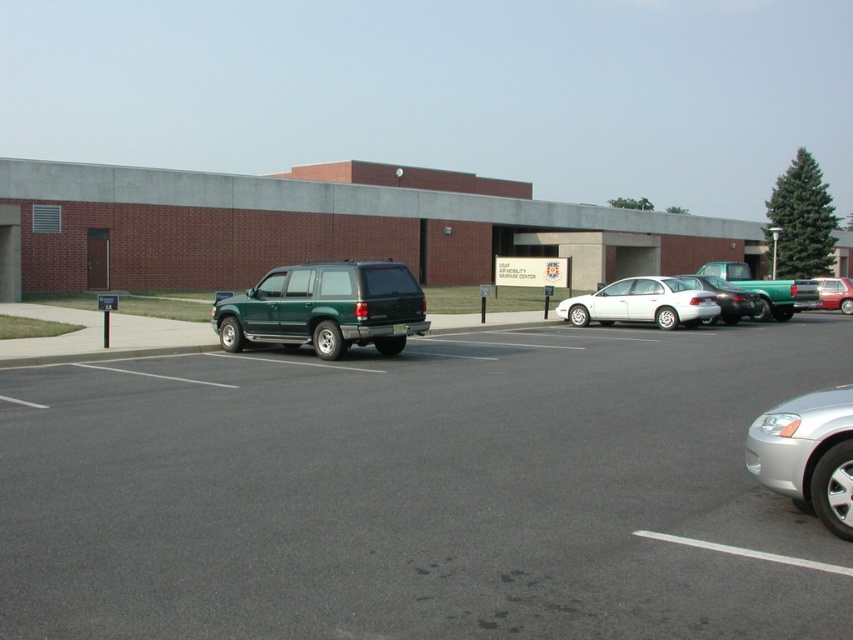
Can you confirm if silver metallic sedan at lower right is wider than white glossy sedan at center?

Incorrect, silver metallic sedan at lower right's width does not surpass white glossy sedan at center's.

Which is behind, point (746, 452) or point (581, 323)?

Positioned behind is point (581, 323).

Identify the location of silver metallic sedan at lower right. (807, 452).

Does white glossy sedan at center appear on the left side of metallic silver sedan at right?

Indeed, white glossy sedan at center is positioned on the left side of metallic silver sedan at right.

Who is shorter, white glossy sedan at center or metallic silver sedan at right?

Standing shorter between the two is white glossy sedan at center.

This screenshot has width=853, height=640. What do you see at coordinates (642, 304) in the screenshot?
I see `white glossy sedan at center` at bounding box center [642, 304].

This screenshot has height=640, width=853. Find the location of `white glossy sedan at center`. white glossy sedan at center is located at coordinates (642, 304).

Does green matte truck at right come in front of shiny black sedan at center?

No, green matte truck at right is behind shiny black sedan at center.

Where is `green matte truck at right`? The height and width of the screenshot is (640, 853). green matte truck at right is located at coordinates (766, 289).